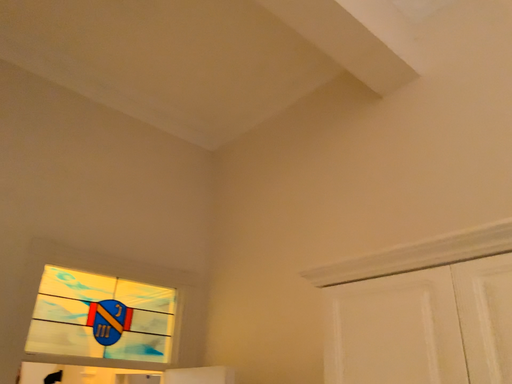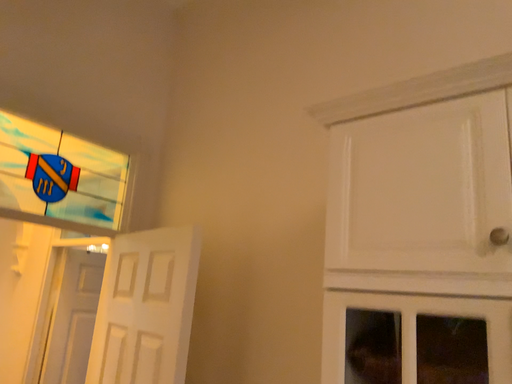
Question: How did the camera likely rotate when shooting the video?

Choices:
 (A) rotated upward
 (B) rotated downward

Answer: (B)